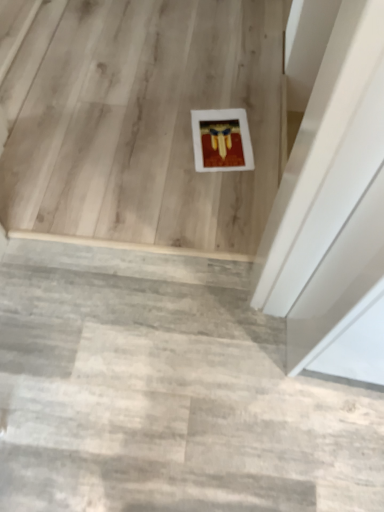
Question: Considering the positions of concrete textured stairs at center, the 2th stairwell when ordered from top to bottom, and white matte frame at center, positioned as the 1th stairwell in top-to-bottom order, in the image, is concrete textured stairs at center, the 2th stairwell when ordered from top to bottom, wider or thinner than white matte frame at center, positioned as the 1th stairwell in top-to-bottom order,?

Choices:
 (A) thin
 (B) wide

Answer: (A)

Question: In terms of size, does concrete textured stairs at center, the 1th stairwell in the front-to-back sequence, appear bigger or smaller than white matte frame at center, the 2th stairwell in the bottom-to-top sequence?

Choices:
 (A) big
 (B) small

Answer: (B)

Question: From the image's perspective, relative to white matte frame at center, the 2th stairwell in the bottom-to-top sequence, is concrete textured stairs at center, the second stairwell viewed from the back, above or below?

Choices:
 (A) below
 (B) above

Answer: (A)

Question: Choose the correct answer: Is white matte frame at center, the second stairwell positioned from the front, inside concrete textured stairs at center, the 1th stairwell positioned from the bottom, or outside it?

Choices:
 (A) outside
 (B) inside

Answer: (A)

Question: From their relative heights in the image, would you say white matte frame at center, acting as the first stairwell starting from the back, is taller or shorter than concrete textured stairs at center, the second stairwell viewed from the back?

Choices:
 (A) short
 (B) tall

Answer: (B)

Question: In terms of width, does white matte frame at center, acting as the first stairwell starting from the back, look wider or thinner when compared to concrete textured stairs at center, the 1th stairwell in the front-to-back sequence?

Choices:
 (A) thin
 (B) wide

Answer: (B)

Question: In terms of size, does white matte frame at center, acting as the first stairwell starting from the back, appear bigger or smaller than concrete textured stairs at center, the 1th stairwell in the front-to-back sequence?

Choices:
 (A) big
 (B) small

Answer: (A)